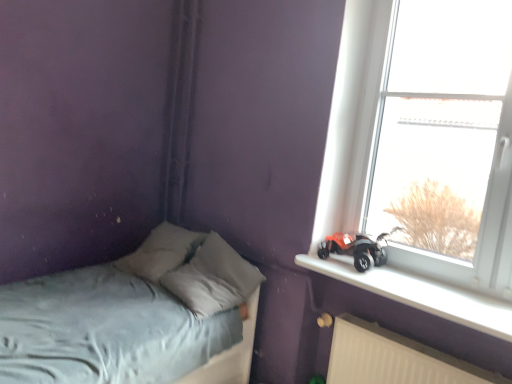
Question: Is light blue fabric bed at lower left oriented away from gray fabric pillow at center?

Choices:
 (A) yes
 (B) no

Answer: (B)

Question: Would you say gray fabric pillow at center is part of light blue fabric bed at lower left's contents?

Choices:
 (A) no
 (B) yes

Answer: (B)

Question: Is light blue fabric bed at lower left far away from gray fabric pillow at center?

Choices:
 (A) yes
 (B) no

Answer: (B)

Question: From the image's perspective, is light blue fabric bed at lower left located above gray fabric pillow at center?

Choices:
 (A) yes
 (B) no

Answer: (B)

Question: Does light blue fabric bed at lower left turn towards gray fabric pillow at center?

Choices:
 (A) no
 (B) yes

Answer: (B)

Question: From a real-world perspective, is light blue fabric bed at lower left below gray fabric pillow at center?

Choices:
 (A) no
 (B) yes

Answer: (B)

Question: Are gray fabric pillow at center and orange matte toy car at window sill far apart?

Choices:
 (A) yes
 (B) no

Answer: (B)

Question: Is the depth of gray fabric pillow at center less than that of orange matte toy car at window sill?

Choices:
 (A) yes
 (B) no

Answer: (B)

Question: Is gray fabric pillow at center wider than orange matte toy car at window sill?

Choices:
 (A) no
 (B) yes

Answer: (B)

Question: From the image's perspective, does gray fabric pillow at center appear lower than orange matte toy car at window sill?

Choices:
 (A) yes
 (B) no

Answer: (A)

Question: Is gray fabric pillow at center smaller than orange matte toy car at window sill?

Choices:
 (A) yes
 (B) no

Answer: (B)

Question: Can you confirm if gray fabric pillow at center is taller than orange matte toy car at window sill?

Choices:
 (A) no
 (B) yes

Answer: (B)

Question: Does orange matte toy car at window sill have a lesser height compared to white plastic radiator at lower right?

Choices:
 (A) yes
 (B) no

Answer: (A)